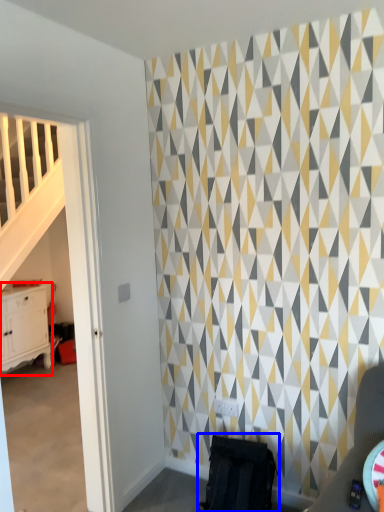
Question: Which of the following is the closest to the observer, chest of drawers (highlighted by a red box) or swivel chair (highlighted by a blue box)?

Choices:
 (A) chest of drawers
 (B) swivel chair

Answer: (B)